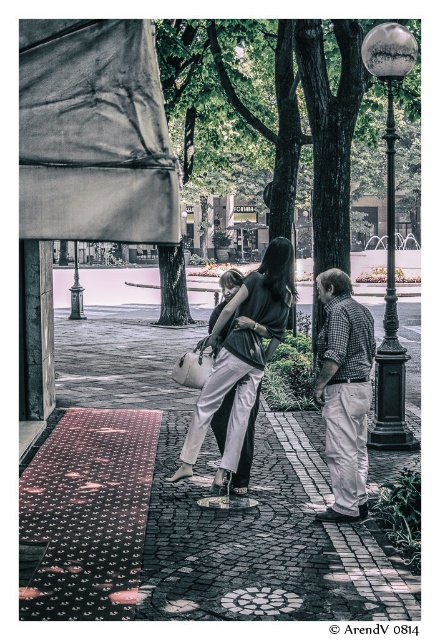
Is the position of checkered fabric shirt at center less distant than that of shiny black pole at right?

Yes.

Does point (367, 384) lie in front of point (388, 192)?

Yes, point (367, 384) is in front of point (388, 192).

This screenshot has width=440, height=640. What do you see at coordinates (344, 392) in the screenshot?
I see `checkered fabric shirt at center` at bounding box center [344, 392].

The width and height of the screenshot is (440, 640). Identify the location of checkered fabric shirt at center. (344, 392).

Is polished stone pavement at center positioned in front of shiny black pole at right?

Yes, it is in front of shiny black pole at right.

Can you confirm if polished stone pavement at center is positioned below shiny black pole at right?

No.

Between point (107, 333) and point (388, 42), which one is positioned behind?

Point (107, 333)

Locate an element on the screen. This screenshot has height=640, width=440. polished stone pavement at center is located at coordinates (223, 513).

Is point (120, 216) positioned behind point (343, 275)?

No, it is not.

Between point (143, 99) and point (337, 276), which one is positioned in front?

Point (143, 99) is more forward.

Is point (149, 67) farther from camera compared to point (338, 496)?

No, it is not.

Find the location of a particular element. matte gray fabric canopy at upper left is located at coordinates (94, 132).